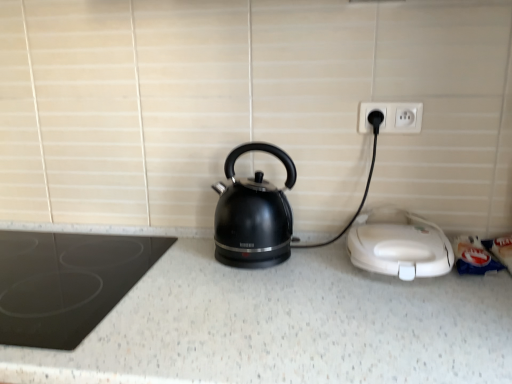
Question: Is white speckled granite at center not close to white plastic sandwich maker at lower right, which is the first home appliance in right-to-left order?

Choices:
 (A) yes
 (B) no

Answer: (B)

Question: Can you confirm if white speckled granite at center is thinner than white plastic sandwich maker at lower right, which is the first home appliance in right-to-left order?

Choices:
 (A) yes
 (B) no

Answer: (B)

Question: Is white speckled granite at center facing away from white plastic sandwich maker at lower right, which is the first home appliance in right-to-left order?

Choices:
 (A) yes
 (B) no

Answer: (B)

Question: Can you confirm if white speckled granite at center is positioned to the right of white plastic sandwich maker at lower right, which is the first home appliance in right-to-left order?

Choices:
 (A) no
 (B) yes

Answer: (A)

Question: Is white speckled granite at center further to the viewer compared to white plastic sandwich maker at lower right, placed as the second home appliance when sorted from left to right?

Choices:
 (A) no
 (B) yes

Answer: (A)

Question: From a real-world perspective, is white speckled granite at center positioned over white plastic sandwich maker at lower right, placed as the second home appliance when sorted from left to right, based on gravity?

Choices:
 (A) yes
 (B) no

Answer: (B)

Question: From the image's perspective, does black glossy kettle at center appear lower than white speckled granite at center?

Choices:
 (A) yes
 (B) no

Answer: (B)

Question: Considering the relative sizes of black glossy kettle at center and white speckled granite at center in the image provided, is black glossy kettle at center bigger than white speckled granite at center?

Choices:
 (A) no
 (B) yes

Answer: (A)

Question: Can you confirm if black glossy kettle at center is thinner than white speckled granite at center?

Choices:
 (A) yes
 (B) no

Answer: (A)

Question: Considering the relative sizes of black glossy kettle at center and white speckled granite at center in the image provided, is black glossy kettle at center shorter than white speckled granite at center?

Choices:
 (A) no
 (B) yes

Answer: (B)

Question: Considering the relative positions of black glossy kettle at center and white speckled granite at center in the image provided, is black glossy kettle at center in front of white speckled granite at center?

Choices:
 (A) no
 (B) yes

Answer: (A)

Question: Is black glossy kettle at center at the right side of white speckled granite at center?

Choices:
 (A) yes
 (B) no

Answer: (A)

Question: Is the position of white speckled granite at center more distant than that of black glass cooktop at left, placed as the second home appliance when sorted from right to left?

Choices:
 (A) yes
 (B) no

Answer: (B)